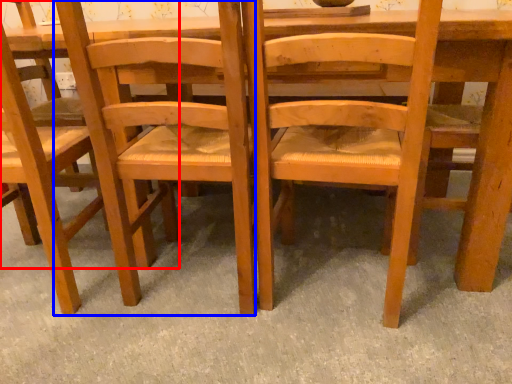
Question: Which object is further to the camera taking this photo, chair (highlighted by a red box) or chair (highlighted by a blue box)?

Choices:
 (A) chair
 (B) chair

Answer: (A)